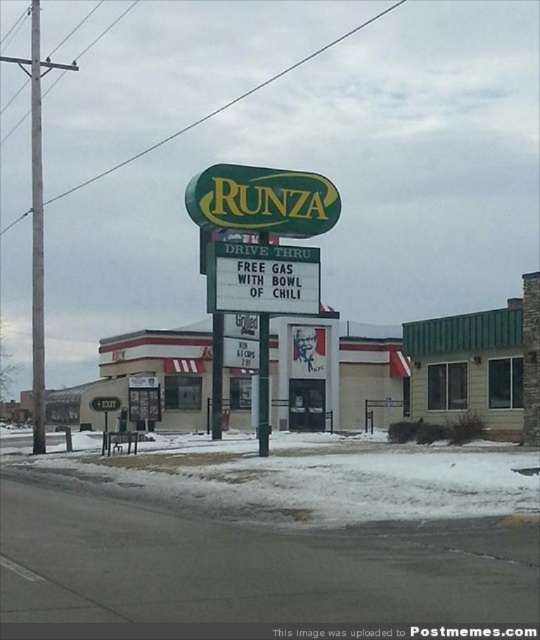
Measure the distance between white powdery snow at lower center and camera.

white powdery snow at lower center is 13.79 meters from camera.

The width and height of the screenshot is (540, 640). In order to click on white powdery snow at lower center in this screenshot , I will do `click(329, 477)`.

Is point (395, 456) closer to camera compared to point (267, 301)?

Yes, point (395, 456) is in front of point (267, 301).

Locate an element on the screen. white powdery snow at lower center is located at coordinates (329, 477).

Does white powdery snow at lower center have a larger size compared to green plastic sign at upper center?

No, white powdery snow at lower center is not bigger than green plastic sign at upper center.

Between point (340, 493) and point (295, 177), which one is positioned in front?

Point (340, 493) is more forward.

Is point (187, 461) more distant than point (249, 227)?

Yes, point (187, 461) is farther from viewer.

Locate an element on the screen. white powdery snow at lower center is located at coordinates (329, 477).

Is point (258, 212) positioned before point (260, 308)?

Yes, it is.

Which is behind, point (273, 188) or point (227, 296)?

The point (273, 188) is behind.

This screenshot has width=540, height=640. I want to click on green plastic sign at upper center, so 262,200.

I want to click on green plastic sign at upper center, so click(x=262, y=200).